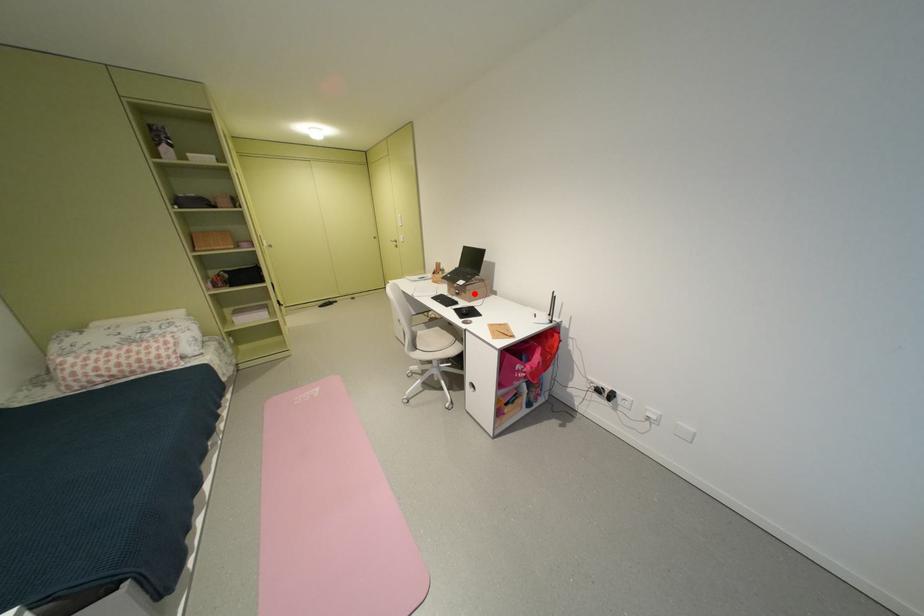
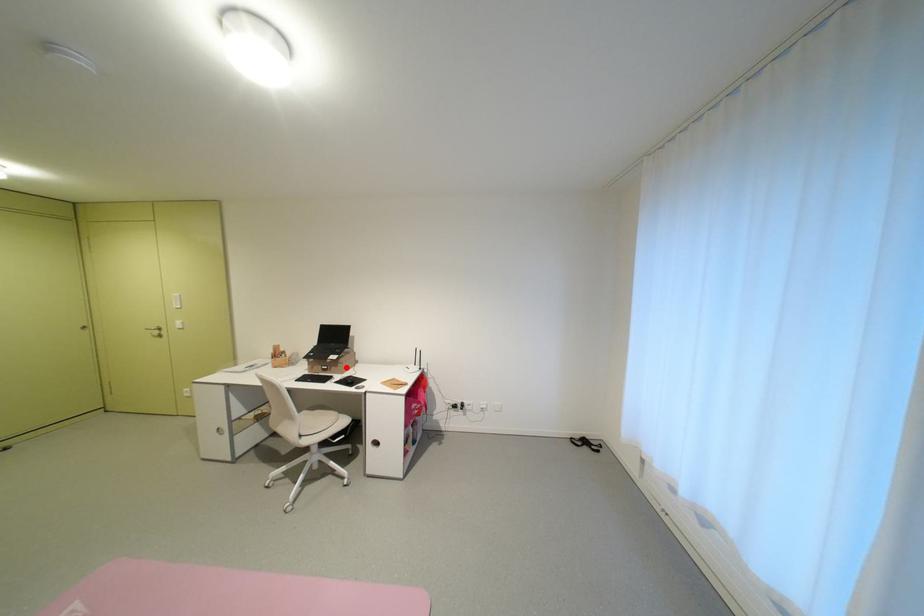
I am providing you with two images of the same scene from different viewpoints. A red point is marked on the first image and another point is marked on the second image. Does the point marked in image1 correspond to the same location as the one in image2?

Yes